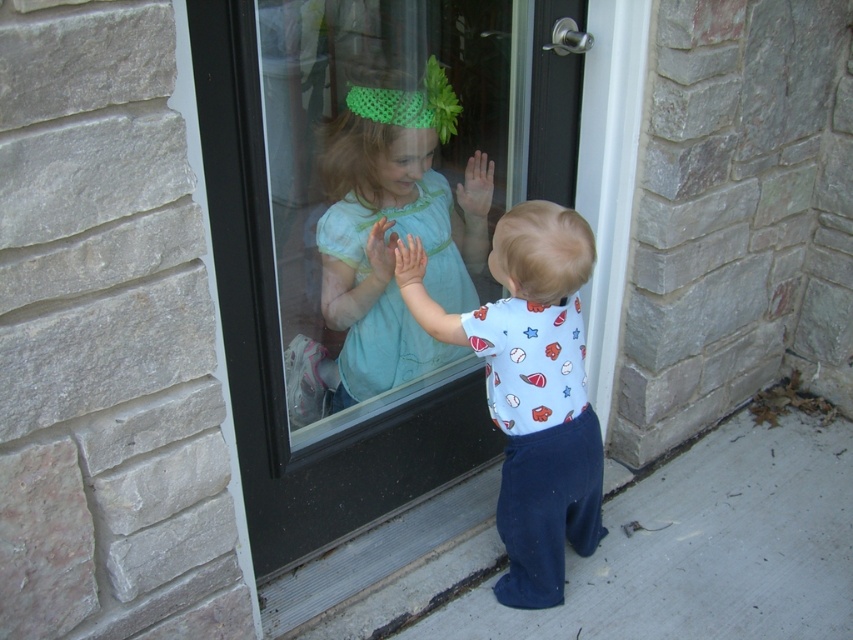
You are a parent trying to hand a toy to your child through the clear glass door at center. The toy is placed on the light blue cotton onesie at center. Can you reach the toy without opening the door?

The clear glass door at center is located above the light blue cotton onesie at center, so you cannot reach the toy without opening the door because the door is blocking access.

You are a parent trying to dress your child in the light blue cotton onesie at center. The clear glass door at center is in the way. Can you move the onesie to the side of the door without folding it?

The clear glass door at center is wider than the light blue cotton onesie at center, so you can move the onesie to the side of the door without folding it.

You are a photographer trying to capture a candid shot of both children in the scene. Since you want to ensure both are fully visible in the frame, which child should you focus on first, the one wearing the light blue cotton onesie at center or the light blue fabric dress at center?

The light blue cotton onesie at center is taller than the light blue fabric dress at center, so you should focus on the light blue cotton onesie at center first to ensure proper framing.